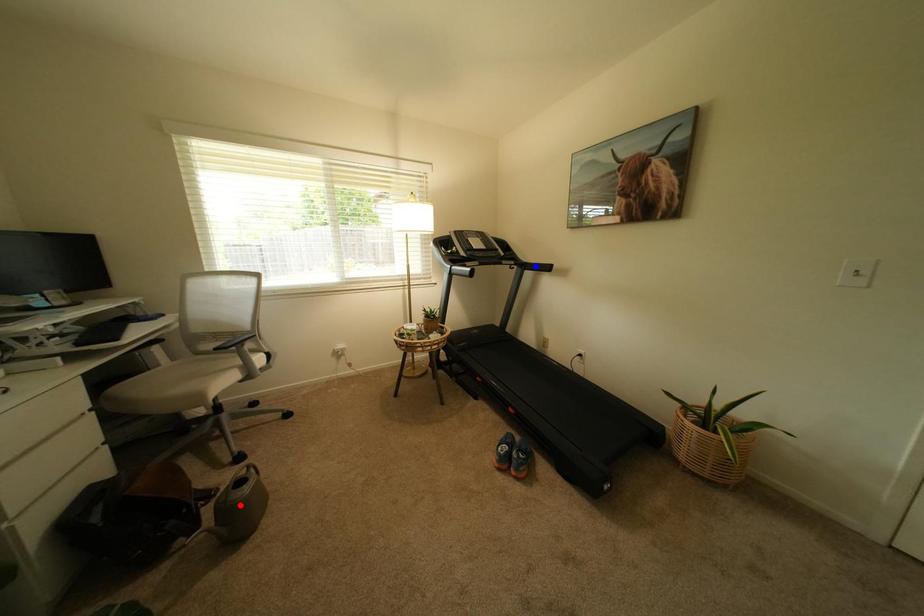
Question: In the image, two points are highlighted. Which point is nearer to the camera? Reply with the corresponding letter.

Choices:
 (A) blue point
 (B) red point

Answer: (B)